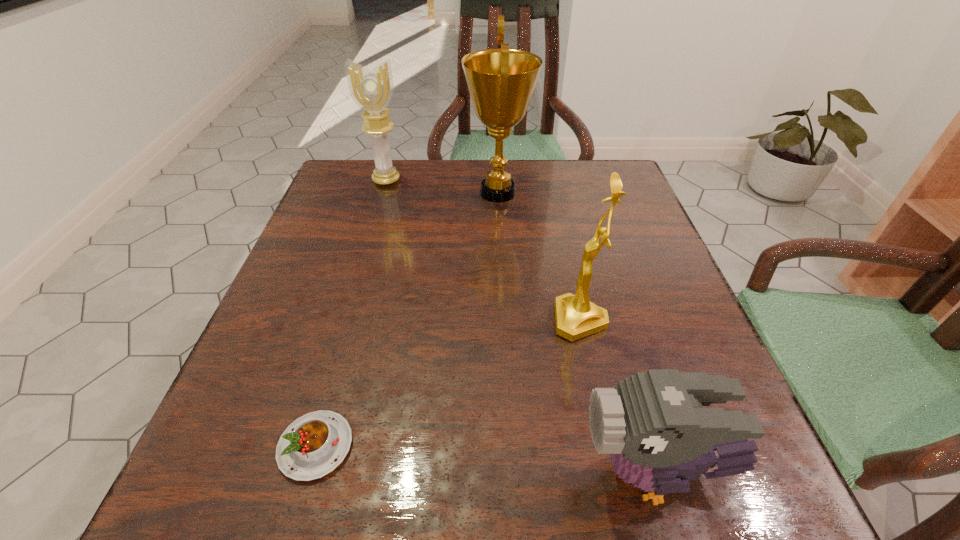
The height and width of the screenshot is (540, 960). In the image, there is a desktop. In order to click on vacant space at the right edge in this screenshot , I will do `click(618, 267)`.

This screenshot has width=960, height=540. In order to click on free space at the far left corner of the desktop in this screenshot , I will do `click(319, 211)`.

Find the location of a particular element. This screenshot has width=960, height=540. unoccupied position between the nearest award and the shortest object is located at coordinates (448, 383).

You are a GUI agent. You are given a task and a screenshot of the screen. Output one action in this format:
    pyautogui.click(x=<x>, y=<y>)
    Task: Click on the free space between the shortest object and the rightmost award
    This screenshot has height=540, width=960.
    Given the screenshot: What is the action you would take?
    (x=448, y=383)

I want to click on free spot between the leftmost award and the pudding, so click(x=351, y=313).

Locate an element on the screen. vacant region between the tallest award and the leftmost award is located at coordinates (443, 186).

Locate an element on the screen. The image size is (960, 540). vacant area that lies between the second shortest object and the leftmost award is located at coordinates (521, 327).

Where is `vacant area that lies between the rightmost award and the third object from right to left`? The image size is (960, 540). vacant area that lies between the rightmost award and the third object from right to left is located at coordinates (539, 256).

Identify the location of free spot between the leftmost award and the nearest award. The height and width of the screenshot is (540, 960). (483, 250).

Find the location of a particular element. The height and width of the screenshot is (540, 960). unoccupied position between the tallest award and the third nearest object is located at coordinates (539, 256).